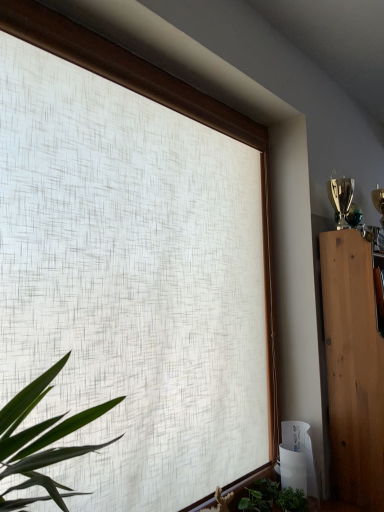
Question: From a real-world perspective, is green leafy plant at lower center positioned under green matte plant at lower right based on gravity?

Choices:
 (A) yes
 (B) no

Answer: (A)

Question: Is green leafy plant at lower center aimed at green matte plant at lower right?

Choices:
 (A) no
 (B) yes

Answer: (B)

Question: Is green leafy plant at lower center outside green matte plant at lower right?

Choices:
 (A) no
 (B) yes

Answer: (B)

Question: Does green leafy plant at lower center appear on the right side of green matte plant at lower right?

Choices:
 (A) no
 (B) yes

Answer: (A)

Question: Can you confirm if green leafy plant at lower center is taller than green matte plant at lower right?

Choices:
 (A) yes
 (B) no

Answer: (B)

Question: Is green leafy plant at lower center positioned in front of green matte plant at lower right?

Choices:
 (A) yes
 (B) no

Answer: (B)

Question: From the image's perspective, does light brown wood cabinet at right appear lower than green matte plant at lower right?

Choices:
 (A) no
 (B) yes

Answer: (A)

Question: From the image's perspective, is light brown wood cabinet at right on top of green matte plant at lower right?

Choices:
 (A) yes
 (B) no

Answer: (A)

Question: Is green matte plant at lower right surrounded by light brown wood cabinet at right?

Choices:
 (A) no
 (B) yes

Answer: (A)

Question: Could you tell me if light brown wood cabinet at right is facing green matte plant at lower right?

Choices:
 (A) no
 (B) yes

Answer: (A)

Question: Does light brown wood cabinet at right have a lesser width compared to green matte plant at lower right?

Choices:
 (A) yes
 (B) no

Answer: (B)

Question: Is light brown wood cabinet at right far away from green matte plant at lower right?

Choices:
 (A) yes
 (B) no

Answer: (B)

Question: Considering the relative sizes of light brown wood cabinet at right and green leafy plant at lower center in the image provided, is light brown wood cabinet at right taller than green leafy plant at lower center?

Choices:
 (A) yes
 (B) no

Answer: (A)